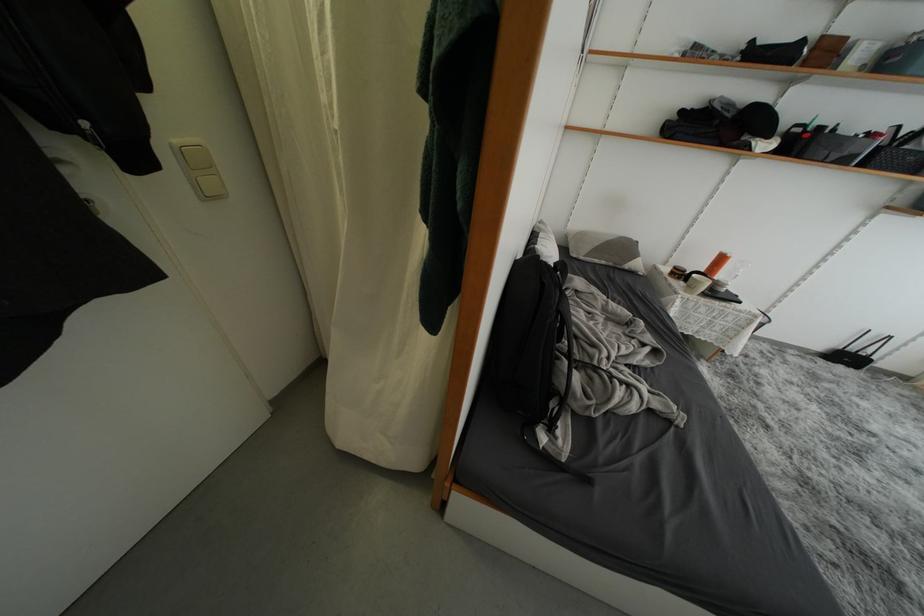
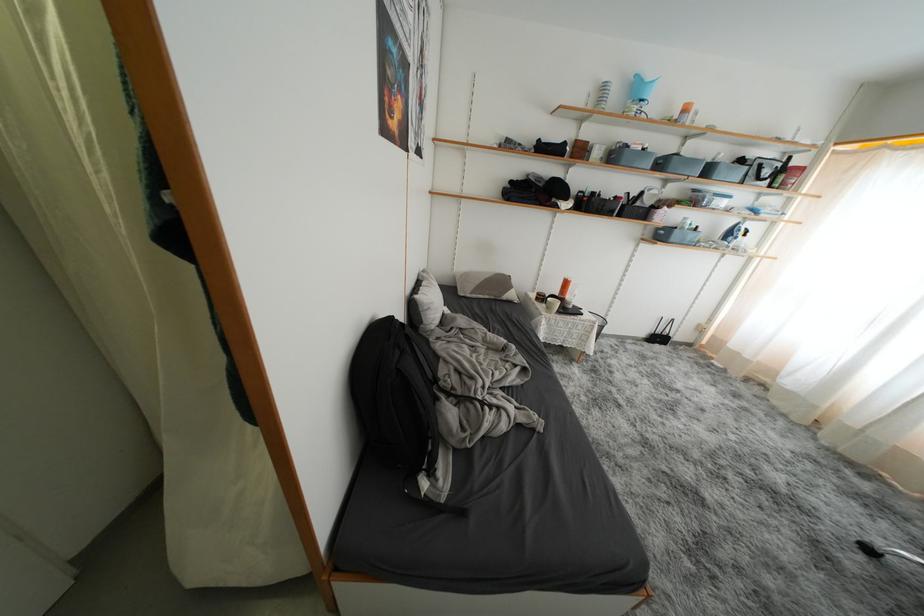
Question: How did the camera likely rotate?

Choices:
 (A) Left
 (B) Right
 (C) Up
 (D) Down

Answer: (B)